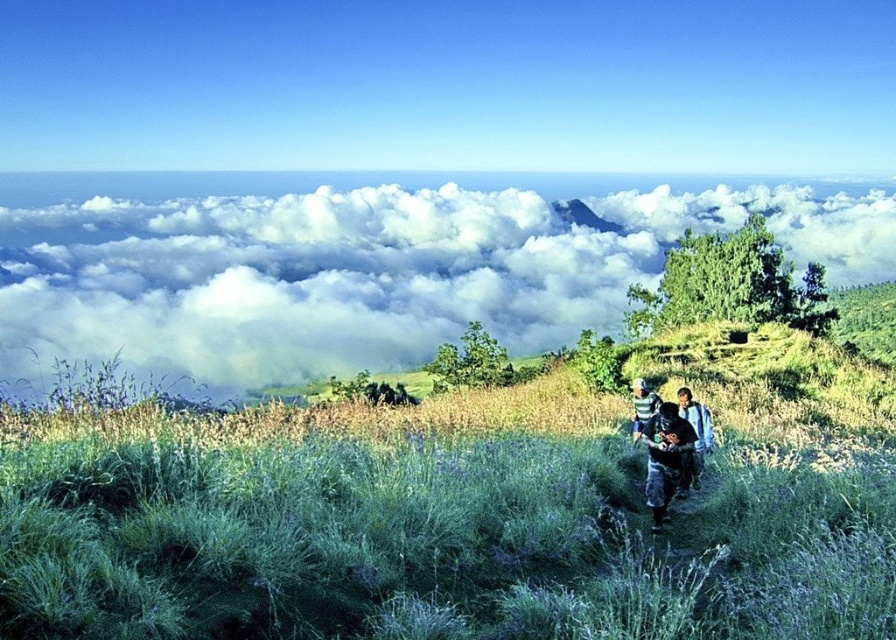
Question: Among these points, which one is nearest to the camera?

Choices:
 (A) (x=428, y=324)
 (B) (x=655, y=508)
 (C) (x=705, y=417)
 (D) (x=872, y=595)

Answer: (D)

Question: Does white fluffy cloud at upper center appear over striped fabric shirt at center?

Choices:
 (A) yes
 (B) no

Answer: (A)

Question: Is blue denim jacket at lower right positioned at the back of striped fabric shirt at center?

Choices:
 (A) yes
 (B) no

Answer: (B)

Question: Observing the image, what is the correct spatial positioning of blue denim jacket at lower right in reference to striped fabric shirt at center?

Choices:
 (A) left
 (B) right

Answer: (A)

Question: Considering the real-world distances, which object is farthest from the striped fabric shirt at center?

Choices:
 (A) white fluffy cloud at upper center
 (B) green grassy at center
 (C) blue denim jacket at lower right
 (D) striped cotton shirt at center

Answer: (A)

Question: Which object appears farthest from the camera in this image?

Choices:
 (A) striped fabric shirt at center
 (B) striped cotton shirt at center
 (C) green grassy at center

Answer: (A)